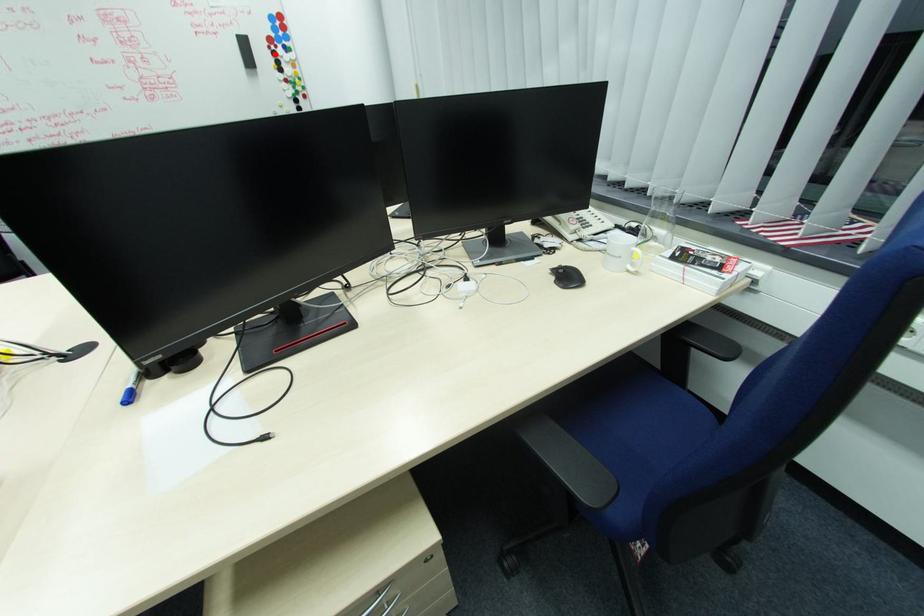
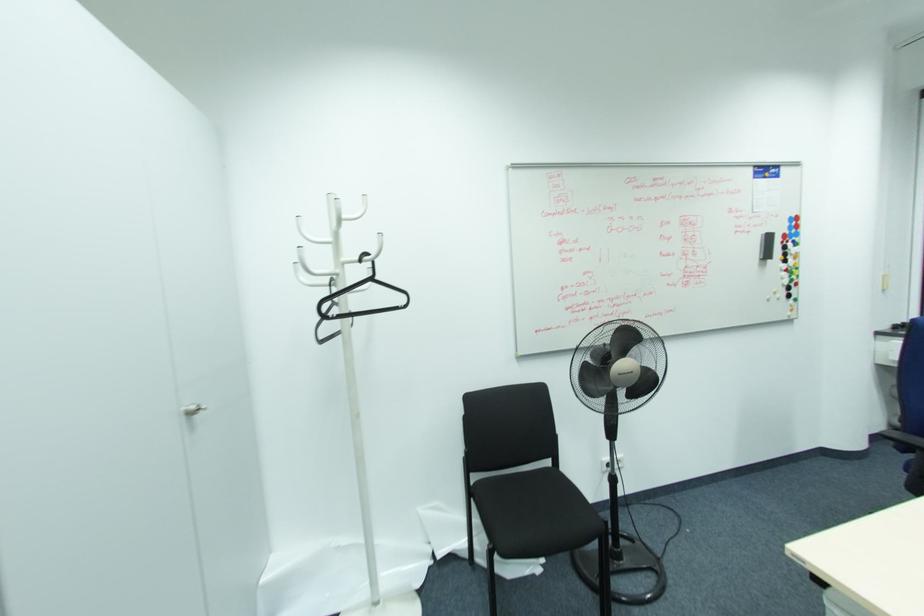
Locate, in the second image, the point that corresponds to the highlighted location in the first image.

(785, 248)